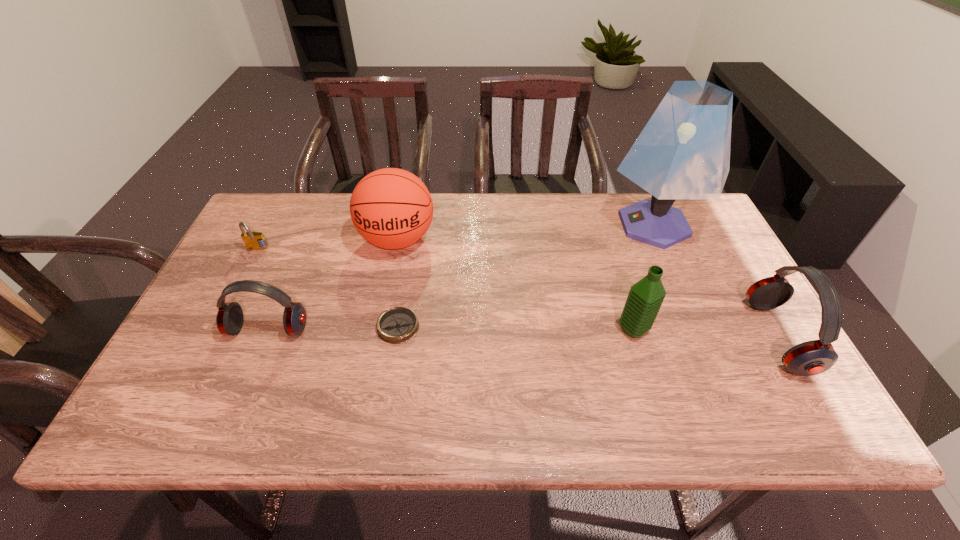
Find the location of `free space that is in between the shorter earphone and the water bottle`. free space that is in between the shorter earphone and the water bottle is located at coordinates coord(450,329).

Image resolution: width=960 pixels, height=540 pixels. Find the location of `vacant region between the water bottle and the sixth tallest object`. vacant region between the water bottle and the sixth tallest object is located at coordinates (445, 290).

At what (x,y) coordinates should I click in order to perform the action: click on empty space between the water bottle and the basketball. Please return your answer as a coordinate pair (x, y). Looking at the image, I should click on coord(516,285).

Identify the location of empty location between the water bottle and the second shortest object. The width and height of the screenshot is (960, 540). (445, 290).

At what (x,y) coordinates should I click in order to perform the action: click on vacant area that lies between the padlock and the lampshade. Please return your answer as a coordinate pair (x, y). The image size is (960, 540). Looking at the image, I should click on (456, 238).

Locate an element on the screen. Image resolution: width=960 pixels, height=540 pixels. empty location between the right earphone and the tallest object is located at coordinates point(715,281).

You are a GUI agent. You are given a task and a screenshot of the screen. Output one action in this format:
    pyautogui.click(x=<x>, y=<y>)
    Task: Click on the free area in between the tallest object and the right earphone
    This screenshot has height=540, width=960.
    Given the screenshot: What is the action you would take?
    pyautogui.click(x=715, y=281)

This screenshot has width=960, height=540. What are the coordinates of `free space between the tallest object and the compass` in the screenshot? It's located at (526, 276).

This screenshot has height=540, width=960. I want to click on free space that is in between the taller earphone and the basketball, so click(x=588, y=288).

Select which object is the second closest to the water bottle. Please provide its 2D coordinates. Your answer should be formatted as a tuple, i.e. [(x, y)], where the tuple contains the x and y coordinates of a point satisfying the conditions above.

[(813, 357)]